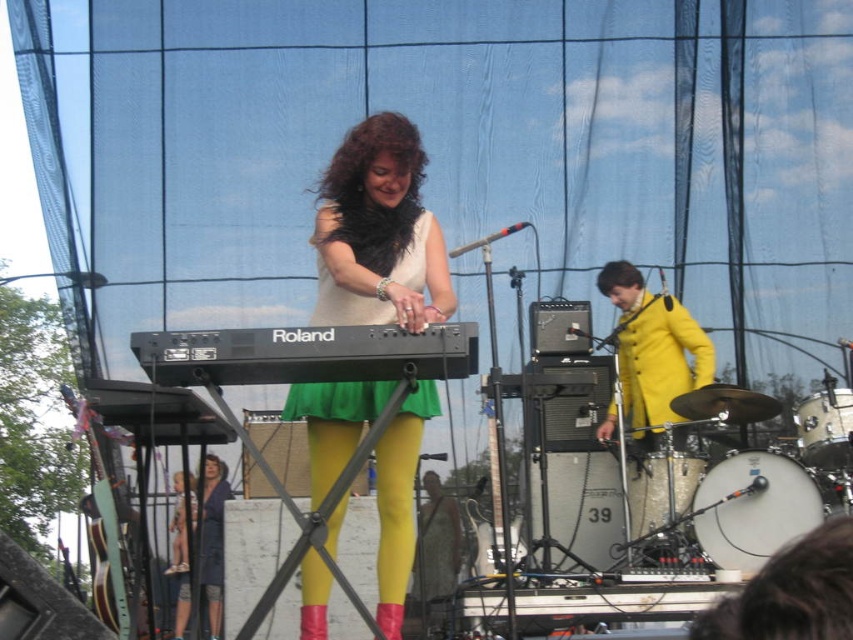
You are a photographer standing in front of the stage. You want to take a photo of the black matte keyboard at center and the yellow matte jacket at center. Which object will appear larger in your photo?

The black matte keyboard at center will appear larger in the photo because it is closer to the viewer than the yellow matte jacket at center.

You are a photographer at the live music performance. You want to take a photo that includes both the keyboard player and the drummer. The keyboard player is at point (335, 216) and the drummer is at point (115, 602). Since you want both subjects to be in focus, which point should you focus on?

You should focus on point (335, 216) because it is closer to the camera than point (115, 602). When focusing on the closer subject, the farther one may still be in acceptable focus depending on the lens and aperture used.

From the picture: You are a stagehand setting up a microphone stand. You need to place it at point (305, 355). The stage has a black matte keyboard at center. Will the microphone stand be placed on the keyboard?

Yes, the microphone stand will be placed on the black matte keyboard at center because the point (305, 355) is on the keyboard.